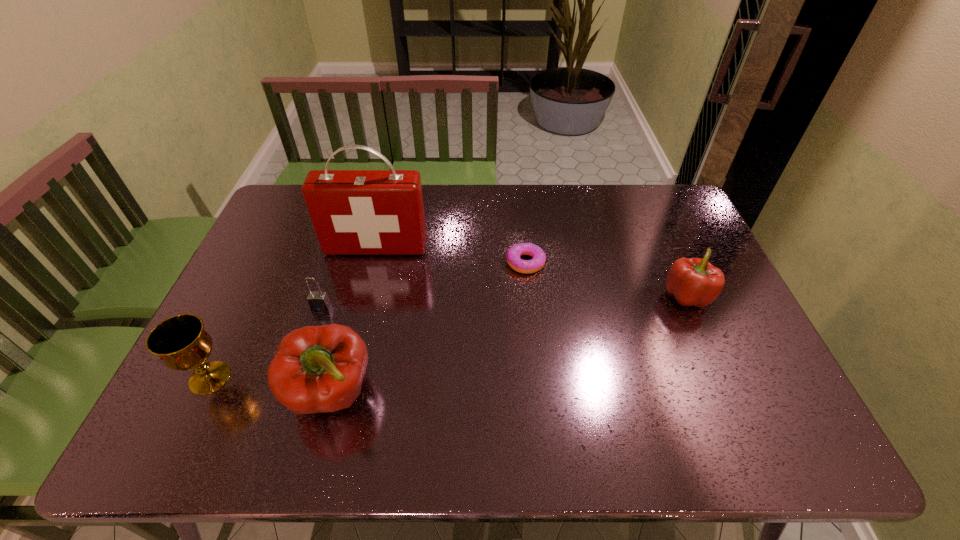
You are a GUI agent. You are given a task and a screenshot of the screen. Output one action in this format:
    pyautogui.click(x=<x>, y=<y>)
    Task: Click on the nearer bell pepper
    
    Given the screenshot: What is the action you would take?
    pyautogui.click(x=316, y=369)

Where is `the left bell pepper`? the left bell pepper is located at coordinates (316, 369).

At what (x,y) coordinates should I click in order to perform the action: click on the farther bell pepper. Please return your answer as a coordinate pair (x, y). Looking at the image, I should click on (691, 281).

The height and width of the screenshot is (540, 960). In order to click on the right bell pepper in this screenshot , I will do `click(691, 281)`.

Where is `the tallest object`? The width and height of the screenshot is (960, 540). the tallest object is located at coordinates (354, 212).

You are a GUI agent. You are given a task and a screenshot of the screen. Output one action in this format:
    pyautogui.click(x=<x>, y=<y>)
    Task: Click on the padlock
    
    Given the screenshot: What is the action you would take?
    pyautogui.click(x=317, y=301)

Locate an element on the screen. the fifth object from left to right is located at coordinates 513,255.

Locate an element on the screen. The height and width of the screenshot is (540, 960). doughnut is located at coordinates (513, 255).

Locate an element on the screen. This screenshot has height=540, width=960. the leftmost object is located at coordinates (181, 343).

Locate an element on the screen. vacant space positioned on the back of the nearer bell pepper is located at coordinates (350, 323).